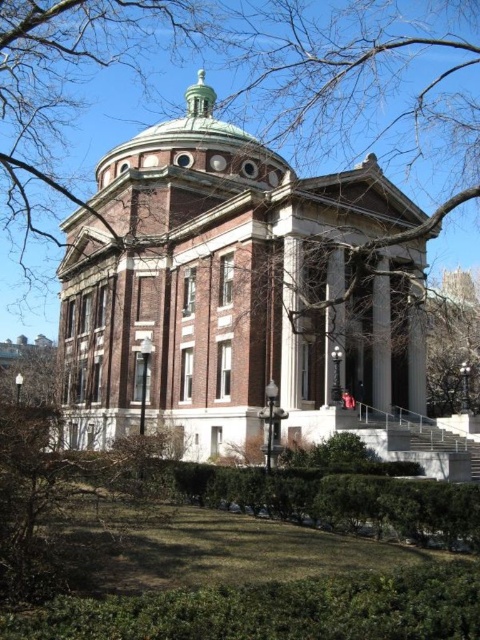
You are a visitor approaching the grand neoclassical building and notice the green polished dome at center and the white marble column at center. Which object would you see first as you walk towards the building?

The green polished dome at center would be seen first because the white marble column at center is positioned behind it, meaning the dome is closer to your viewpoint as you approach the building.

You are an architect designing a scale model of the building. You have a limited amount of green material for the dome and white material for the pillars. Based on the image, which object requires more material between the green polished dome at center and the white marble pillar at center?

The green polished dome at center requires more material than the white marble pillar at center because it is larger in size.

You are standing at point (290, 324) in the image. What object is located exactly at this point?

The white marble pillar at center is located exactly at point (290, 324).